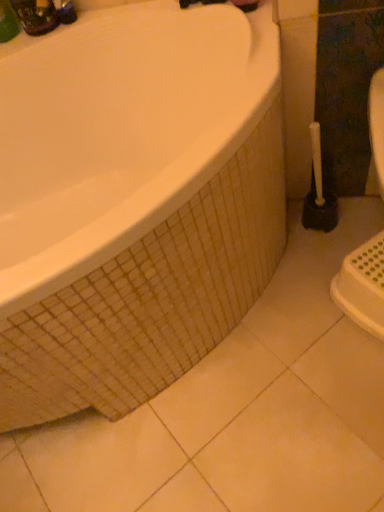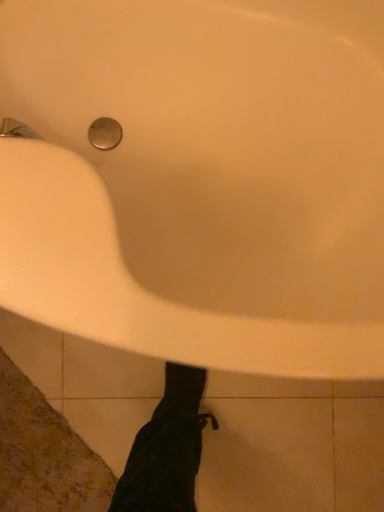
Question: How did the camera likely rotate when shooting the video?

Choices:
 (A) rotated right
 (B) rotated left

Answer: (B)